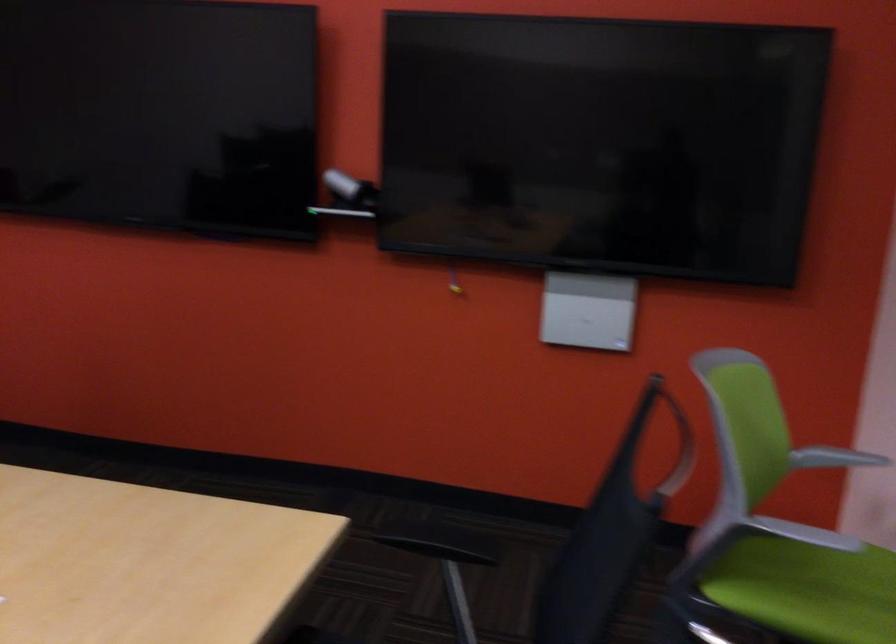
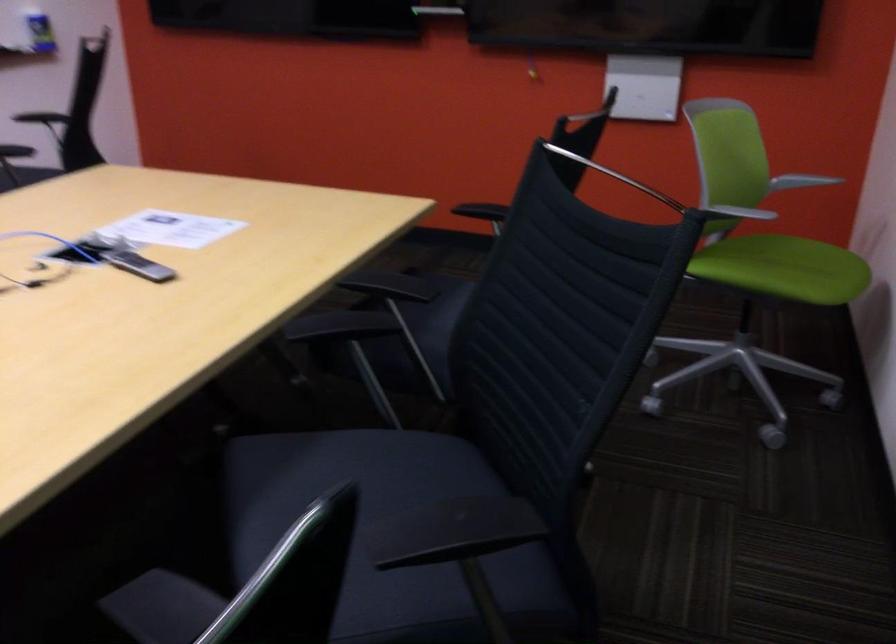
Question: The images are taken continuously from a first-person perspective. In which direction are you moving?

Choices:
 (A) Left
 (B) Right
 (C) Forward
 (D) Backward

Answer: (D)